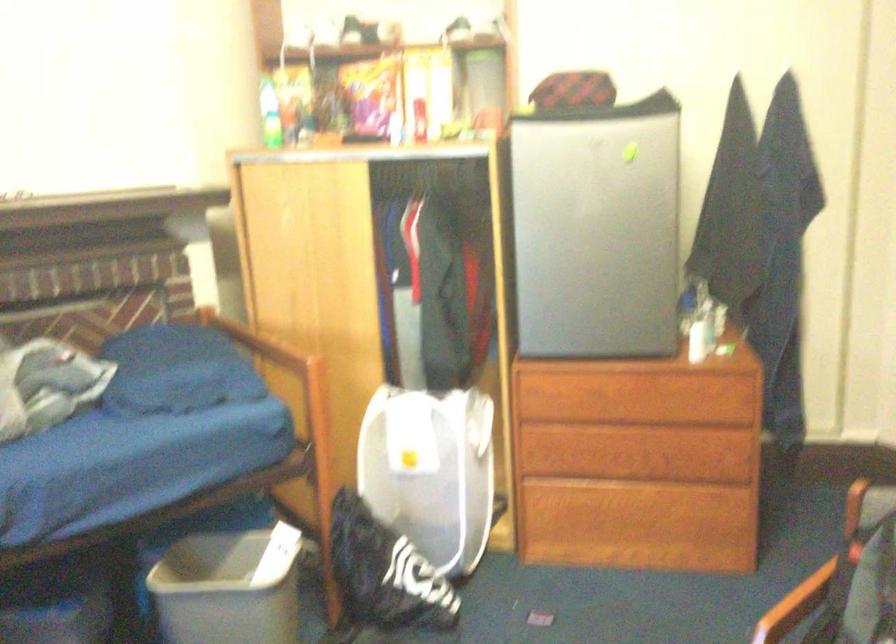
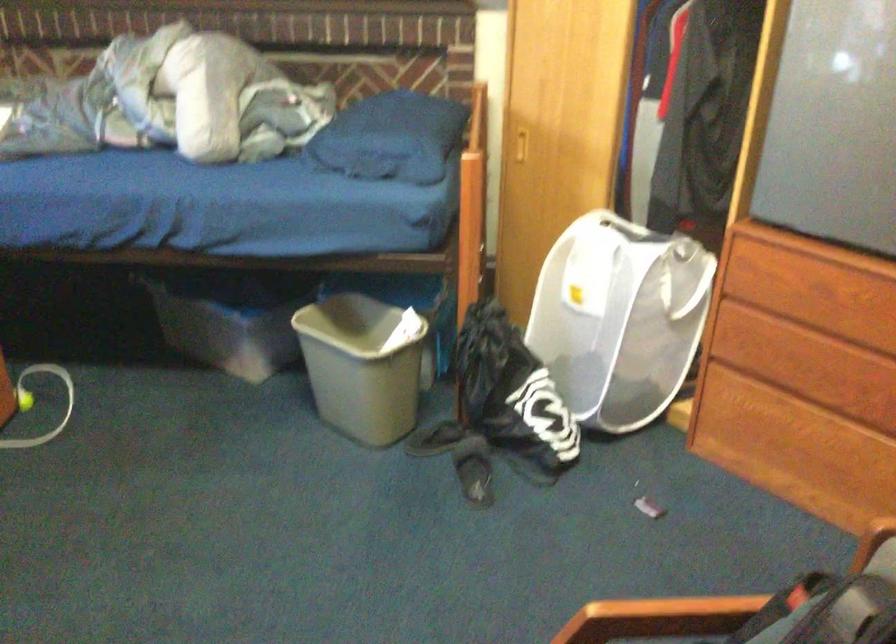
First-person continuous shooting, in which direction is the camera rotating?

The rotation direction of the camera is left-down.